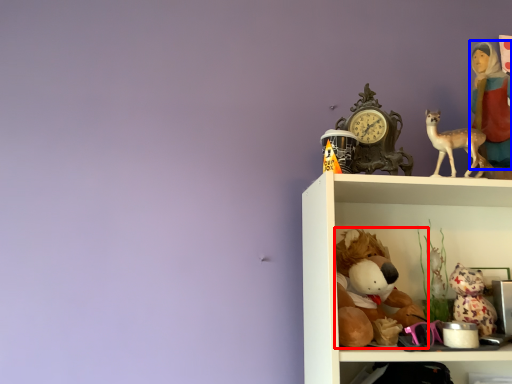
Question: Which of the following is the closest to the observer, toy (highlighted by a red box) or person (highlighted by a blue box)?

Choices:
 (A) toy
 (B) person

Answer: (A)